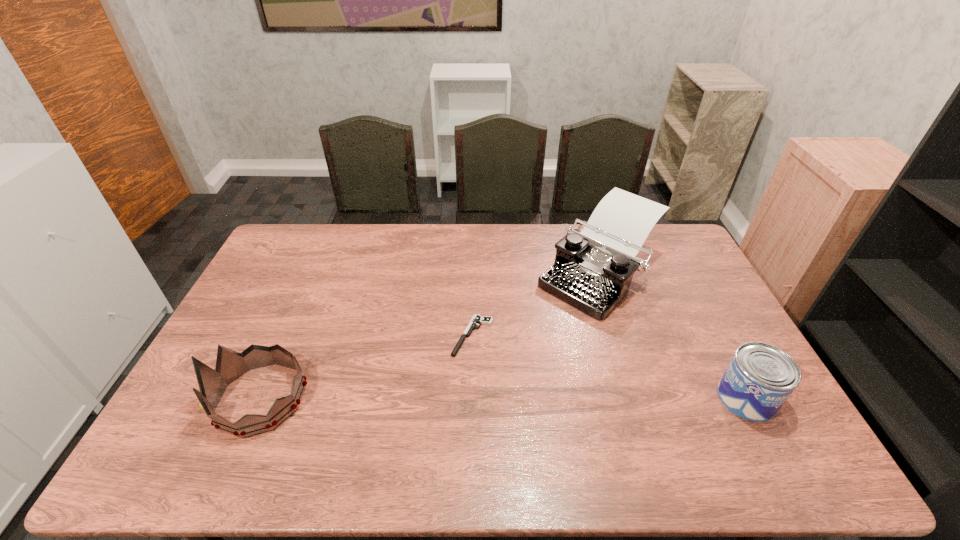
At what (x,y) coordinates should I click in order to perform the action: click on free space on the desktop that is between the third shortest object and the third tallest object and is positioned on the keys of the tallest object. Please return your answer as a coordinate pair (x, y). The width and height of the screenshot is (960, 540). Looking at the image, I should click on (466, 398).

Locate an element on the screen. The width and height of the screenshot is (960, 540). free space on the desktop that is between the third shortest object and the third tallest object and is positioned on the front-facing side of the pistol is located at coordinates (439, 398).